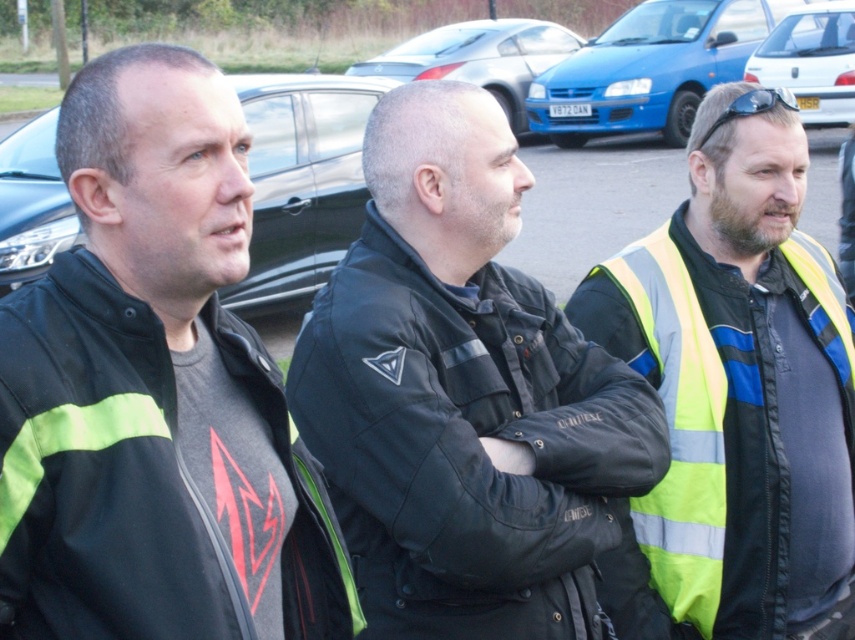
Looking at this image, you are a delivery person who needs to park your vehicle in a tight space between two cars. You see the blue matte hatchback at center and the metallic silver car at center. Which car should you choose to park next to if you need a smaller space?

The blue matte hatchback at center is smaller than the metallic silver car at center, so you should park next to the blue matte hatchback at center as it requires less space.

You are a delivery person who needs to park your van between the blue matte hatchback at center and the metallic silver car at center. Based on the scene description, can you fit your van, which is 1.8 meters wide, between them?

The blue matte hatchback at center is shorter than the metallic silver car at center, but the exact distance between them isn not provided. Without knowing the space between the two cars, it is impossible to determine if the van will fit.